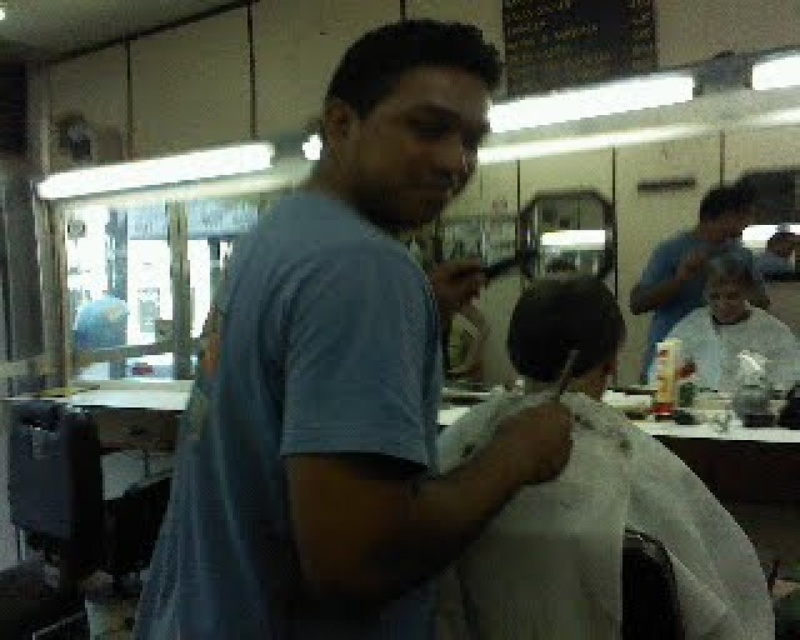
Which is more to the left, white cloth at center or dark brown hair at upper center?

dark brown hair at upper center is more to the left.

The image size is (800, 640). Describe the element at coordinates (732, 332) in the screenshot. I see `white cloth at center` at that location.

Is point (754, 342) closer to viewer compared to point (445, 61)?

No, (754, 342) is behind (445, 61).

Where is `white cloth at center`? white cloth at center is located at coordinates (732, 332).

Who is lower down, matte blue shirt at upper right or matte black hair at upper center?

matte blue shirt at upper right is lower down.

How far apart are matte blue shirt at upper right and matte black hair at upper center?

The distance of matte blue shirt at upper right from matte black hair at upper center is 13.75 centimeters.

You are a GUI agent. You are given a task and a screenshot of the screen. Output one action in this format:
    pyautogui.click(x=<x>, y=<y>)
    Task: Click on the matte blue shirt at upper right
    This screenshot has height=640, width=800.
    Given the screenshot: What is the action you would take?
    (x=694, y=264)

Where is `matte blue shirt at upper right`? matte blue shirt at upper right is located at coordinates (694, 264).

Between dark brown hair at center and dark brown hair at upper center, which one appears on the right side from the viewer's perspective?

dark brown hair at center is more to the right.

Does dark brown hair at center appear on the left side of dark brown hair at upper center?

No, dark brown hair at center is not to the left of dark brown hair at upper center.

Is point (537, 337) positioned after point (354, 99)?

Yes, point (537, 337) is farther from viewer.

You are a GUI agent. You are given a task and a screenshot of the screen. Output one action in this format:
    pyautogui.click(x=<x>, y=<y>)
    Task: Click on the dark brown hair at center
    The height and width of the screenshot is (640, 800).
    Given the screenshot: What is the action you would take?
    pyautogui.click(x=564, y=326)